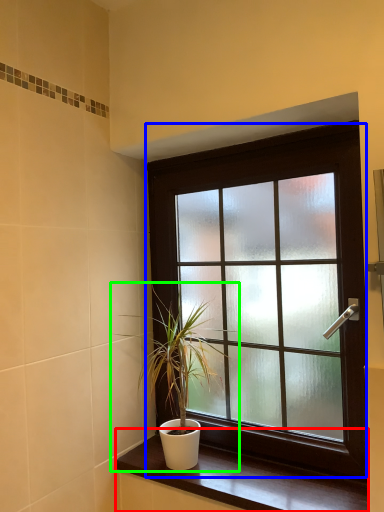
Question: Which is farther away from window sill (highlighted by a red box)? window (highlighted by a blue box) or houseplant (highlighted by a green box)?

Choices:
 (A) window
 (B) houseplant

Answer: (A)